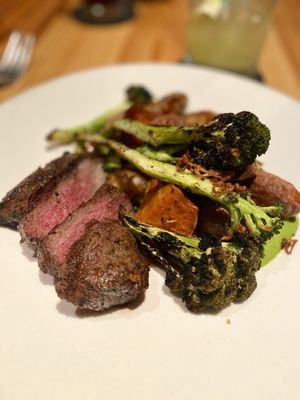
The image size is (300, 400). What are the coordinates of `wooden tabletop` in the screenshot? It's located at (117, 46).